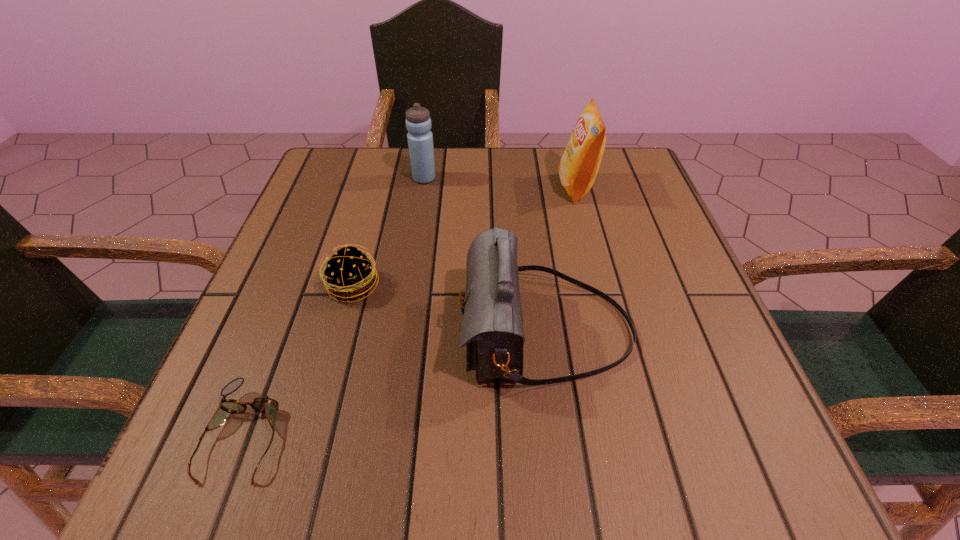
Locate an element on the screen. free spot that satisfies the following two spatial constraints: 1. on the front-facing side of the crisp (potato chip); 2. on the front side of the shoulder bag is located at coordinates (613, 330).